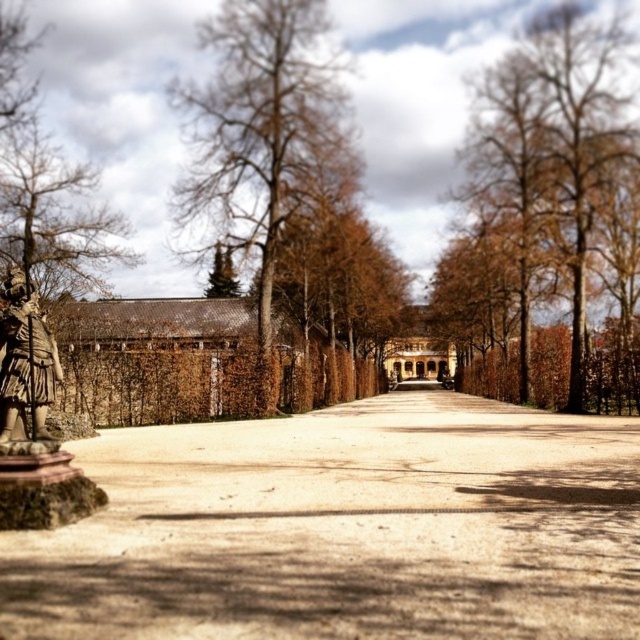
You are standing at the point marked as point (346, 529) on the brown gravel driveway at center. You want to walk to the statue on the left side of the image. Is the statue to your left or right?

The statue is on the left side of the image, so from your position at point (346, 529) on the brown gravel driveway at center, the statue would be to your left.

Looking at this image, you are a delivery driver approaching the grand building at the end of the pathway. You need to park your vehicle on the brown gravel driveway at center. However, there is a bronze statue at left nearby. Considering their heights, which object would you need to avoid hitting with your vehicle if you have to maneuver around it?

The bronze statue at left is taller than the brown gravel driveway at center, so you should avoid hitting the bronze statue at left when maneuvering your vehicle.

You are a gardener planning to plant a new tree along the brown gravel driveway at center. Considering the existing brown textured tree at center, where should you position the new tree to avoid blocking its sunlight?

The brown gravel driveway at center is located below the brown textured tree at center, so planting the new tree on the side opposite to the driveway would ensure the existing tree receives adequate sunlight without obstruction.